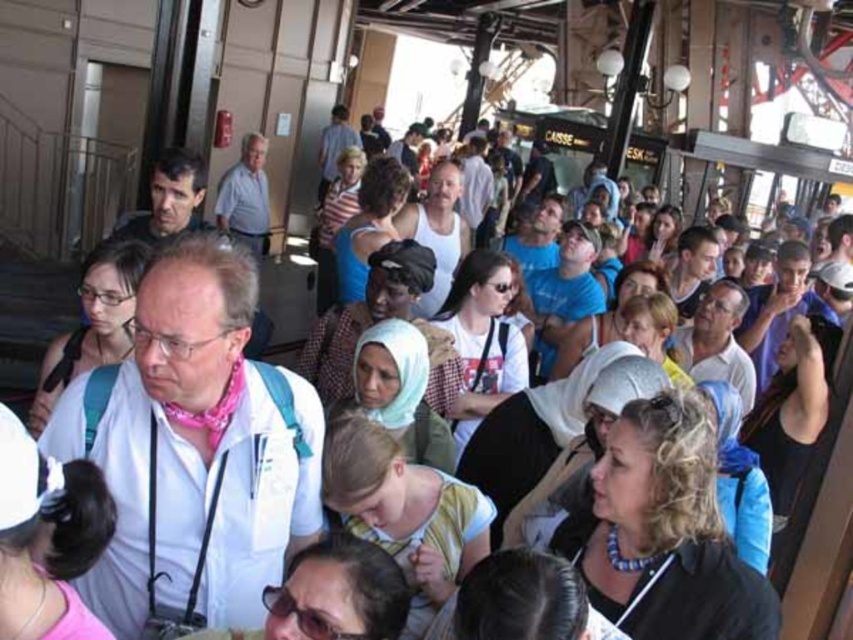
Question: Can you confirm if white cotton shirt at center is thinner than black leather jacket at lower right?

Choices:
 (A) no
 (B) yes

Answer: (A)

Question: Can you confirm if white cotton shirt at center is positioned to the right of black leather jacket at lower right?

Choices:
 (A) no
 (B) yes

Answer: (A)

Question: Which object is farther from the camera taking this photo?

Choices:
 (A) black leather jacket at lower right
 (B) white cotton shirt at center

Answer: (A)

Question: Can you confirm if white cotton shirt at center is positioned above black leather jacket at lower right?

Choices:
 (A) no
 (B) yes

Answer: (B)

Question: Which point is closer to the camera?

Choices:
 (A) (173, 448)
 (B) (598, 512)

Answer: (A)

Question: Which of the following is the closest to the observer?

Choices:
 (A) (622, 525)
 (B) (151, 467)

Answer: (B)